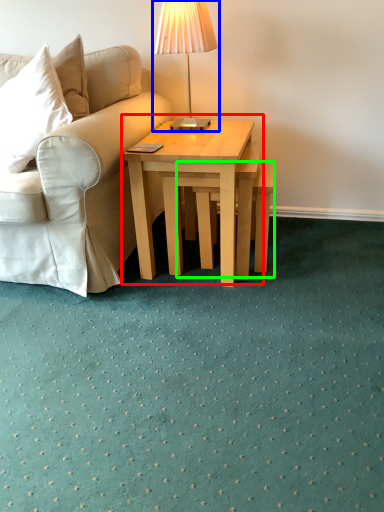
Question: Considering the real-world distances, which object is farthest from coffee table (highlighted by a red box)? table lamp (highlighted by a blue box) or stool (highlighted by a green box)?

Choices:
 (A) table lamp
 (B) stool

Answer: (A)